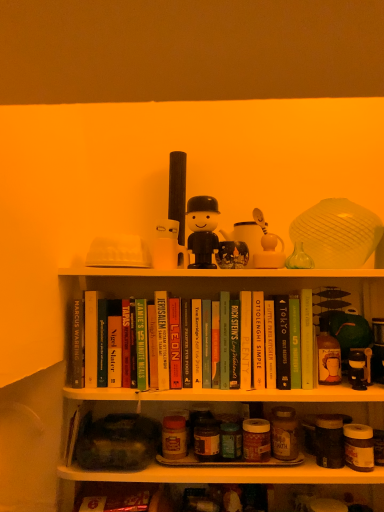
Question: Is hardcover book at center, which is the eleventh paperback book in right-to-left order, closer to the viewer compared to hardcover book at center, the 5th paperback book viewed from the left?

Choices:
 (A) yes
 (B) no

Answer: (B)

Question: Is hardcover book at center, which is counted as the fourth paperback book, starting from the left, oriented towards hardcover book at center, which ranks as the tenth paperback book in right-to-left order?

Choices:
 (A) no
 (B) yes

Answer: (A)

Question: From the image's perspective, is hardcover book at center, which is the eleventh paperback book in right-to-left order, located beneath hardcover book at center, which ranks as the tenth paperback book in right-to-left order?

Choices:
 (A) yes
 (B) no

Answer: (A)

Question: Can you confirm if hardcover book at center, which is counted as the fourth paperback book, starting from the left, is bigger than hardcover book at center, which ranks as the tenth paperback book in right-to-left order?

Choices:
 (A) no
 (B) yes

Answer: (A)

Question: Is hardcover book at center, which is the eleventh paperback book in right-to-left order, to the left of hardcover book at center, the 5th paperback book viewed from the left, from the viewer's perspective?

Choices:
 (A) no
 (B) yes

Answer: (B)

Question: Choose the correct answer: Is hardcover book at center, which is the eighth paperback book in left-to-right order, inside green matte book at center, which is the 1th paperback book from right to left, or outside it?

Choices:
 (A) outside
 (B) inside

Answer: (A)

Question: In terms of height, does hardcover book at center, the seventh paperback book in the right-to-left sequence, look taller or shorter compared to green matte book at center, positioned as the 14th paperback book in left-to-right order?

Choices:
 (A) short
 (B) tall

Answer: (B)

Question: From a real-world perspective, relative to green matte book at center, which is the 1th paperback book from right to left, is hardcover book at center, the seventh paperback book in the right-to-left sequence, vertically above or below?

Choices:
 (A) below
 (B) above

Answer: (B)

Question: From the image's perspective, is hardcover book at center, the seventh paperback book in the right-to-left sequence, above or below green matte book at center, positioned as the 14th paperback book in left-to-right order?

Choices:
 (A) above
 (B) below

Answer: (A)

Question: From the image's perspective, relative to hardcover book at center, which ranks as the fourth paperback book in right-to-left order, is white glossy spoon at upper center, the first toy from the right, above or below?

Choices:
 (A) above
 (B) below

Answer: (A)

Question: Is white glossy spoon at upper center, the first toy from the right, wider or thinner than hardcover book at center, which ranks as the fourth paperback book in right-to-left order?

Choices:
 (A) thin
 (B) wide

Answer: (A)

Question: In the image, is white glossy spoon at upper center, the 4th toy viewed from the left, on the left side or the right side of hardcover book at center, which ranks as the fourth paperback book in right-to-left order?

Choices:
 (A) right
 (B) left

Answer: (B)

Question: Does point (276, 260) appear closer or farther from the camera than point (266, 321)?

Choices:
 (A) farther
 (B) closer

Answer: (B)

Question: From a real-world perspective, is hardcover book at center, which is the eighth paperback book in left-to-right order, positioned above or below hardcover book at center, positioned as the first paperback book in left-to-right order?

Choices:
 (A) above
 (B) below

Answer: (A)

Question: In terms of height, does hardcover book at center, which is the eighth paperback book in left-to-right order, look taller or shorter compared to hardcover book at center, positioned as the first paperback book in left-to-right order?

Choices:
 (A) short
 (B) tall

Answer: (B)